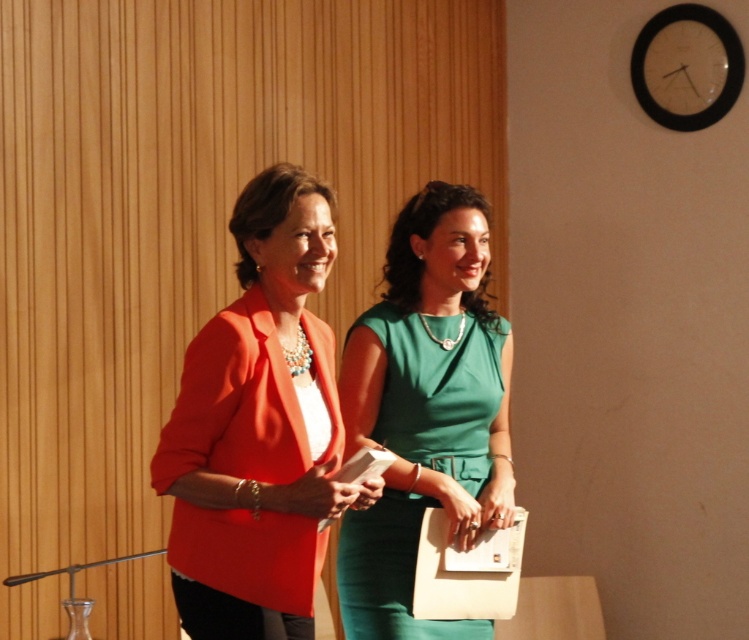
Question: Is matte orange blazer at center to the right of green satin dress at center from the viewer's perspective?

Choices:
 (A) yes
 (B) no

Answer: (B)

Question: Which of the following is the closest to the observer?

Choices:
 (A) green satin dress at center
 (B) matte orange blazer at center

Answer: (B)

Question: Is matte orange blazer at center closer to camera compared to green satin dress at center?

Choices:
 (A) yes
 (B) no

Answer: (A)

Question: Does matte orange blazer at center appear over green satin dress at center?

Choices:
 (A) yes
 (B) no

Answer: (A)